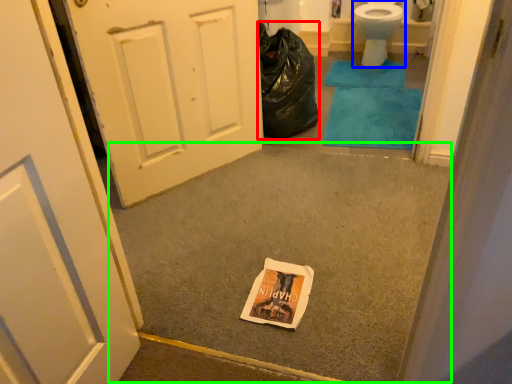
Question: Which object is the farthest from garbage (highlighted by a red box)? Choose among these: toilet (highlighted by a blue box) or concrete (highlighted by a green box).

Choices:
 (A) toilet
 (B) concrete

Answer: (A)